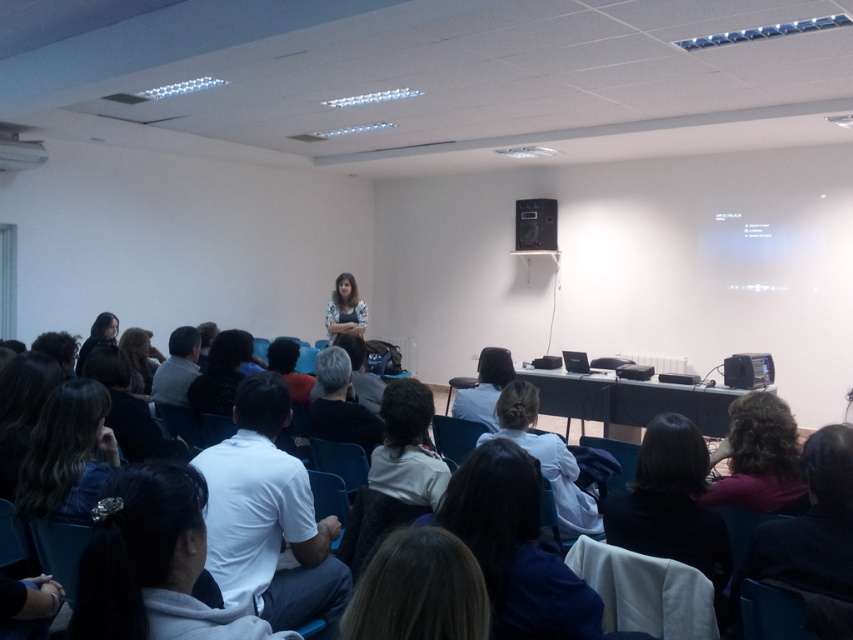
Is point (440, 605) in front of point (537, 224)?

Yes, it is in front of point (537, 224).

Is smooth brown hair at center taller than black plastic speaker at upper center?

Incorrect, smooth brown hair at center's height is not larger of black plastic speaker at upper center's.

In order to click on smooth brown hair at center in this screenshot , I will do `click(418, 589)`.

Between white matte shirt at center and dark brown hair at lower right, which one has more height?

dark brown hair at lower right is taller.

Does white matte shirt at center have a lesser height compared to dark brown hair at lower right?

Yes, white matte shirt at center is shorter than dark brown hair at lower right.

What do you see at coordinates (154, 563) in the screenshot?
I see `white matte shirt at center` at bounding box center [154, 563].

Identify the location of white matte shirt at center. Image resolution: width=853 pixels, height=640 pixels. (154, 563).

Does white fabric shirt at center lie in front of dark brown hair at lower left?

Yes, white fabric shirt at center is closer to the viewer.

Who is more distant from viewer, [544,637] or [51,515]?

Point [51,515]

This screenshot has width=853, height=640. I want to click on white fabric shirt at center, so click(515, 547).